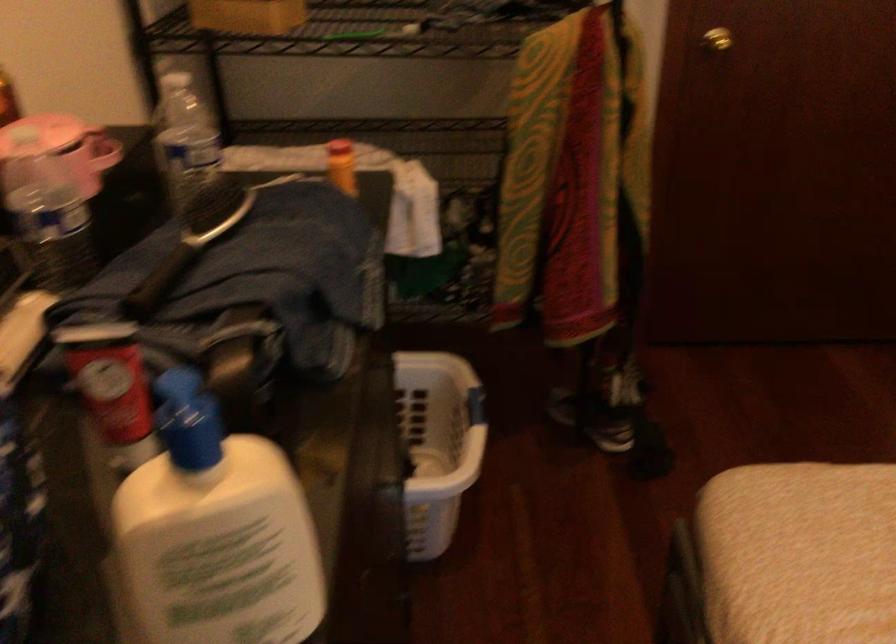
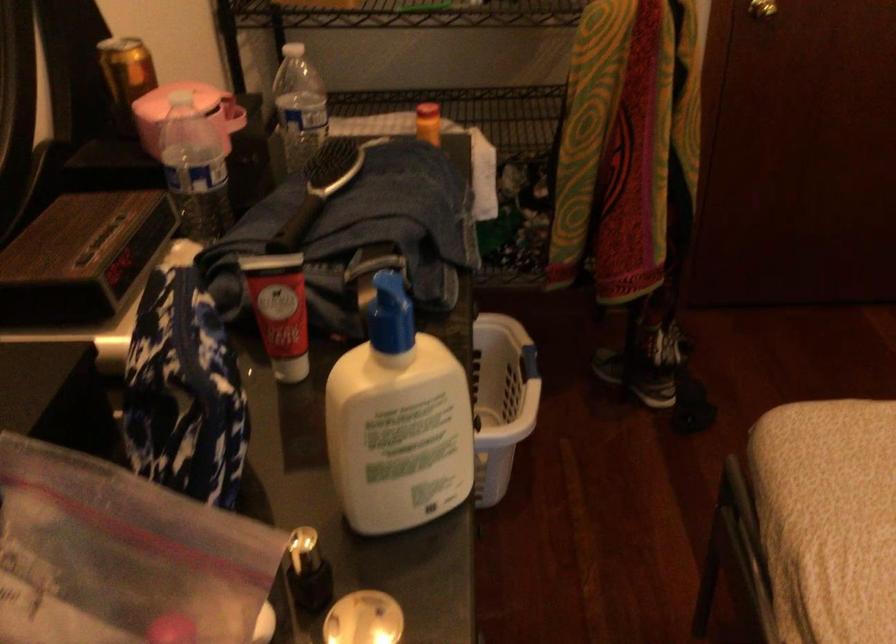
Where in the second image is the point corresponding to (x=185, y=415) from the first image?

(391, 314)